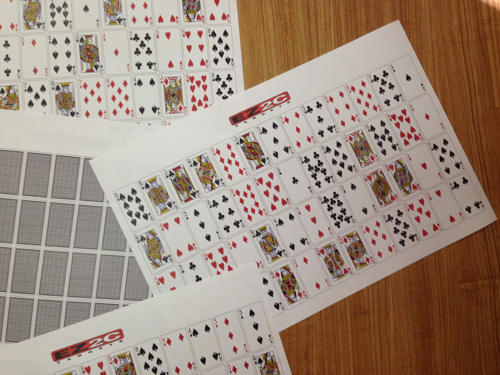
Where is `wooden surface`? wooden surface is located at coordinates (452, 338).